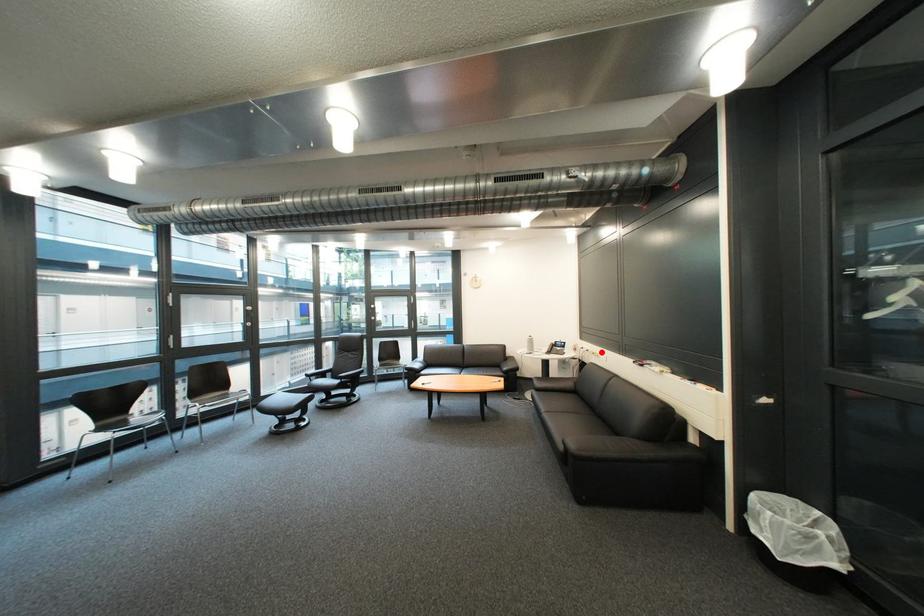
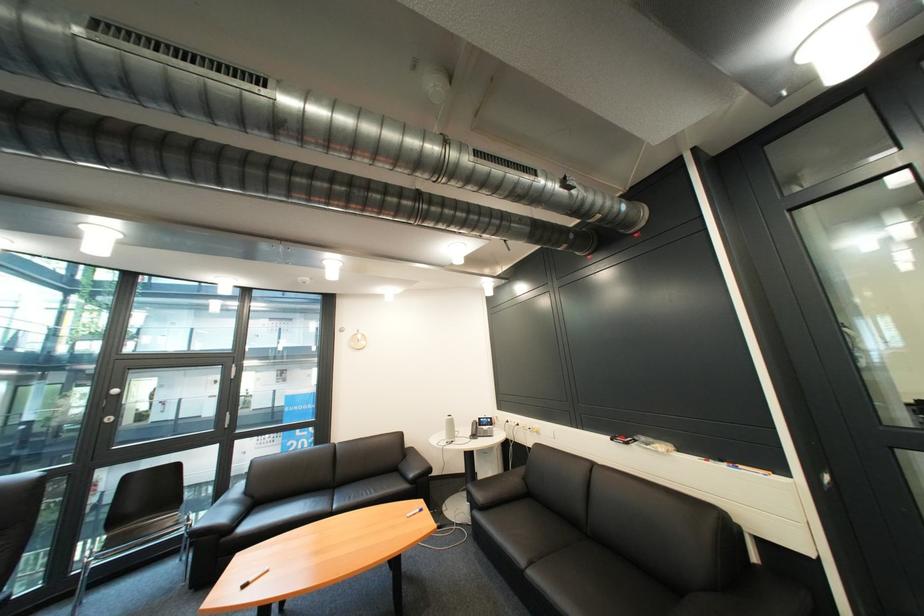
Question: A red point is marked in image1. In image2, is the corresponding 3D point closer to the camera or farther? Reply with the corresponding letter.

Choices:
 (A) The corresponding 3D point is closer.
 (B) The corresponding 3D point is farther.

Answer: (B)